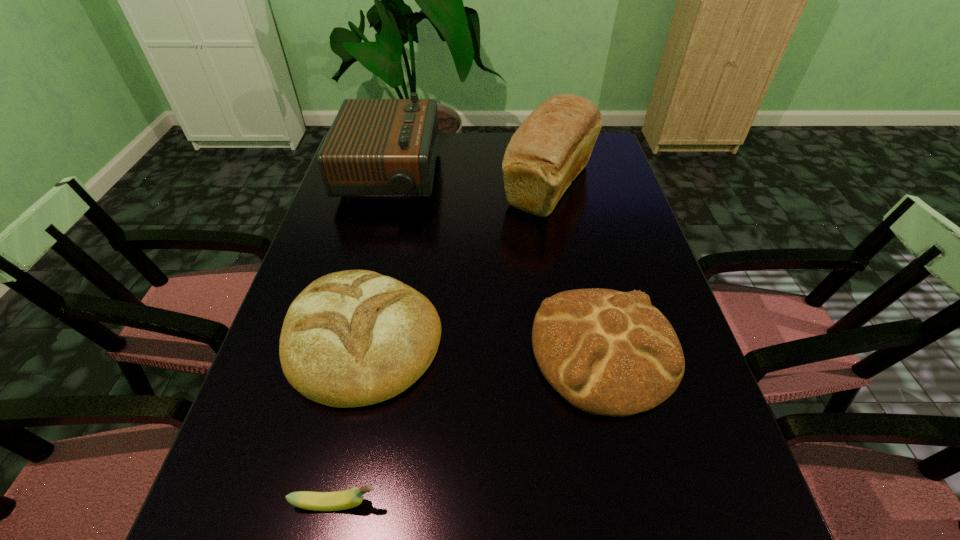
The width and height of the screenshot is (960, 540). Find the location of `the tallest bread`. the tallest bread is located at coordinates (551, 147).

Find the location of a particular element. The height and width of the screenshot is (540, 960). the tallest object is located at coordinates (551, 147).

Where is `the second tallest object`? This screenshot has height=540, width=960. the second tallest object is located at coordinates (376, 148).

Where is `the leftmost bread`? This screenshot has height=540, width=960. the leftmost bread is located at coordinates (352, 338).

Identify the location of banana. The height and width of the screenshot is (540, 960). (340, 500).

At what (x,y) coordinates should I click in order to perform the action: click on the nearest object. Please return your answer as a coordinate pair (x, y). Image resolution: width=960 pixels, height=540 pixels. Looking at the image, I should click on (340, 500).

This screenshot has width=960, height=540. In order to click on free space located 0.060m on the right of the tallest object in this screenshot , I will do `click(620, 185)`.

Locate an element on the screen. vacant space positioned 0.220m on the tuning display of the radio receiver is located at coordinates (506, 177).

In order to click on vacant area located on the front of the leftmost bread in this screenshot , I will do `click(334, 470)`.

Where is `vacant space situated 0.340m at the stem of the nearest object`? The height and width of the screenshot is (540, 960). vacant space situated 0.340m at the stem of the nearest object is located at coordinates click(x=586, y=504).